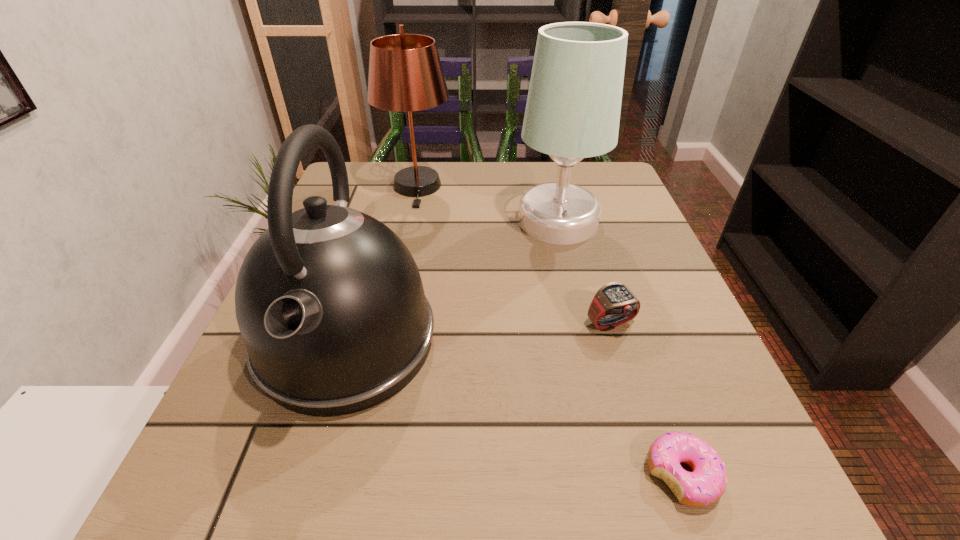
You are a GUI agent. You are given a task and a screenshot of the screen. Output one action in this format:
    pyautogui.click(x=<x>, y=<y>)
    Task: Click on the free point located on the spout of the kettle
    
    Given the screenshot: What is the action you would take?
    pyautogui.click(x=296, y=515)

What are the coordinates of `vacant space situated on the left of the watch` in the screenshot? It's located at (505, 324).

Find the location of `vacant area situated on the left of the shortest object`. vacant area situated on the left of the shortest object is located at coordinates (521, 475).

The height and width of the screenshot is (540, 960). Identify the location of object located in the near edge section of the desktop. (706, 483).

At what (x,y) coordinates should I click in order to perform the action: click on lampshade that is at the left edge. Please return your answer as a coordinate pair (x, y). The image size is (960, 540). Looking at the image, I should click on (405, 74).

Where is `kettle present at the left edge`? This screenshot has width=960, height=540. kettle present at the left edge is located at coordinates (329, 301).

Where is `lampshade located in the right edge section of the desktop`? This screenshot has width=960, height=540. lampshade located in the right edge section of the desktop is located at coordinates (573, 107).

You are a GUI agent. You are given a task and a screenshot of the screen. Output one action in this format:
    pyautogui.click(x=<x>, y=<y>)
    Task: Click on the watch present at the right edge
    
    Given the screenshot: What is the action you would take?
    pyautogui.click(x=614, y=304)

Find the location of a particular element. doughnut located at the right edge is located at coordinates (706, 483).

I want to click on object present at the far left corner, so click(x=405, y=74).